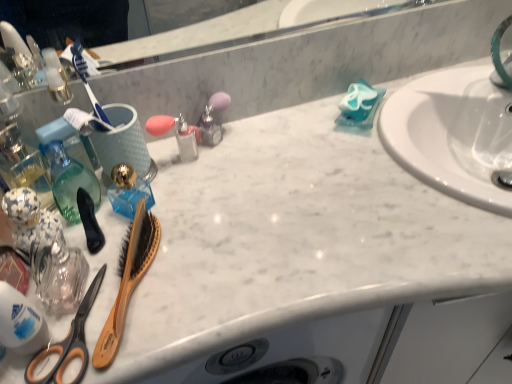
Question: Is translucent blue glass at center in front of or behind black rubber brush at left, the second brush positioned from the right, in the image?

Choices:
 (A) front
 (B) behind

Answer: (B)

Question: From the image's perspective, is translucent blue glass at center positioned above or below black rubber brush at left, the second brush positioned from the right?

Choices:
 (A) below
 (B) above

Answer: (B)

Question: Which object is positioned farthest from the black rubber brush at left, the second brush positioned from the right?

Choices:
 (A) wooden bristle brush at left, which ranks as the 2th brush in left-to-right order
 (B) translucent plastic bottle at lower left, acting as the first cleaning product starting from the front
 (C) translucent purple bottle at center
 (D) translucent blue glass at center
 (E) translucent glass bottle at left

Answer: (C)

Question: Estimate the real-world distances between objects in this image. Which object is closer to the blue matte soap at upper right, which appears as the 1th cleaning product when viewed from the back?

Choices:
 (A) translucent plastic bottle at lower left, arranged as the 2th cleaning product when viewed from the back
 (B) translucent blue glass at center
 (C) black rubber brush at left, which is the first brush in left-to-right order
 (D) translucent purple bottle at center
 (E) orange-handled scissors at lower left

Answer: (D)